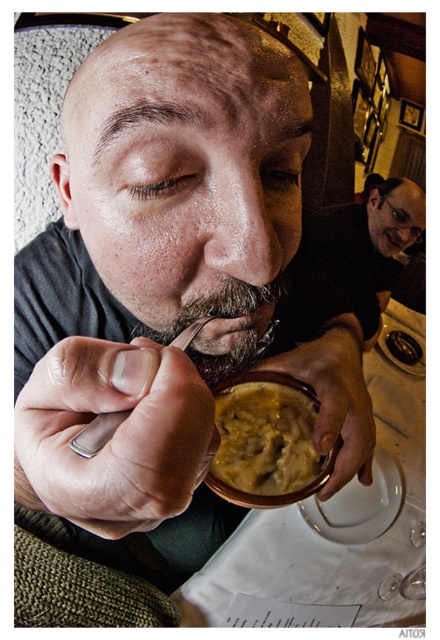
Question: Is white paper at lower center positioned at the back of yellow creamy food at center?

Choices:
 (A) no
 (B) yes

Answer: (B)

Question: Is white paper at lower center below yellow creamy food at center?

Choices:
 (A) no
 (B) yes

Answer: (B)

Question: Which object is closer to the camera taking this photo?

Choices:
 (A) white paper at lower center
 (B) dark brown fuzzy beard at lower center

Answer: (B)

Question: Which object appears closest to the camera in this image?

Choices:
 (A) silver metallic spoon at lower center
 (B) white paper at lower center
 (C) yellow creamy food at center

Answer: (A)

Question: Which point appears farthest from the camera in this image?

Choices:
 (A) (289, 406)
 (B) (348, 266)
 (C) (110, 428)

Answer: (B)

Question: Can you confirm if yellow creamy food at center is positioned above dark brown fuzzy beard at lower center?

Choices:
 (A) yes
 (B) no

Answer: (B)